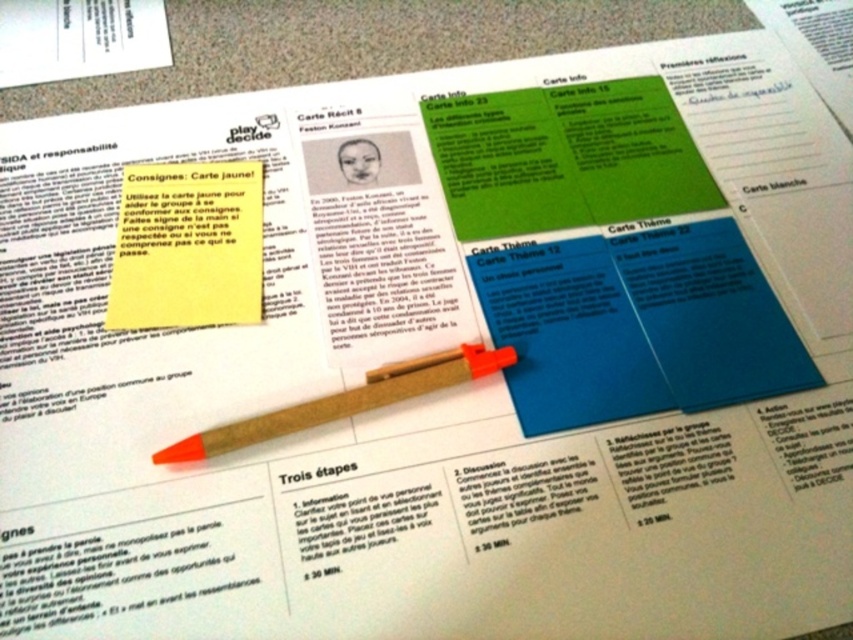
Question: Which point is farther from the camera taking this photo?

Choices:
 (A) (384, 392)
 (B) (183, 236)

Answer: (B)

Question: Is yellow paper at center closer to the viewer compared to wooden pen at center?

Choices:
 (A) no
 (B) yes

Answer: (A)

Question: Is yellow paper at center to the left of wooden pen at center from the viewer's perspective?

Choices:
 (A) no
 (B) yes

Answer: (B)

Question: Considering the relative positions of yellow paper at center and wooden pen at center in the image provided, where is yellow paper at center located with respect to wooden pen at center?

Choices:
 (A) below
 (B) above

Answer: (B)

Question: Which point is closer to the camera taking this photo?

Choices:
 (A) 257,282
 (B) 244,435

Answer: (B)